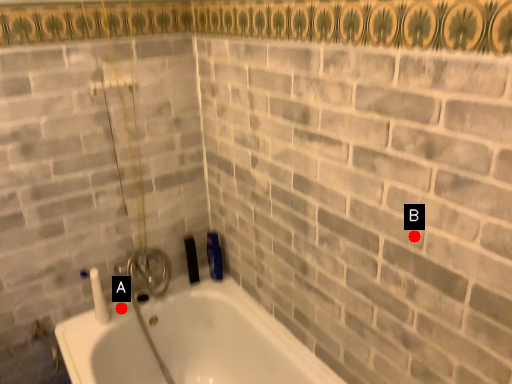
Question: Two points are circled on the image, labeled by A and B beside each circle. Which of the following is the farthest from the observer?

Choices:
 (A) A is further
 (B) B is further

Answer: (A)